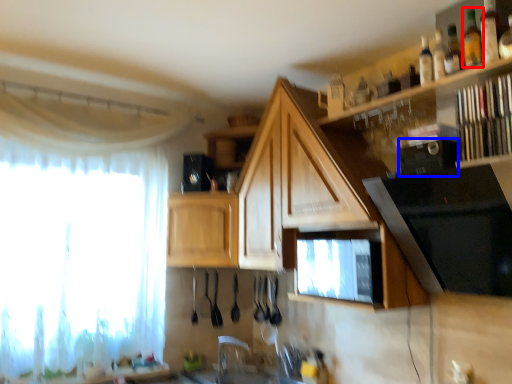
Question: Which of the following is the farthest to the observer, bottle (highlighted by a red box) or appliance (highlighted by a blue box)?

Choices:
 (A) bottle
 (B) appliance

Answer: (A)